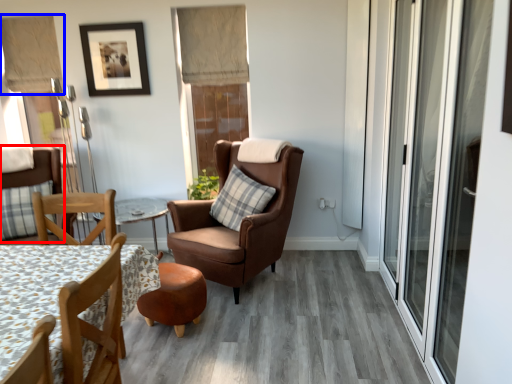
Question: Which point is further to the camera, chair (highlighted by a red box) or curtain (highlighted by a blue box)?

Choices:
 (A) chair
 (B) curtain

Answer: (B)